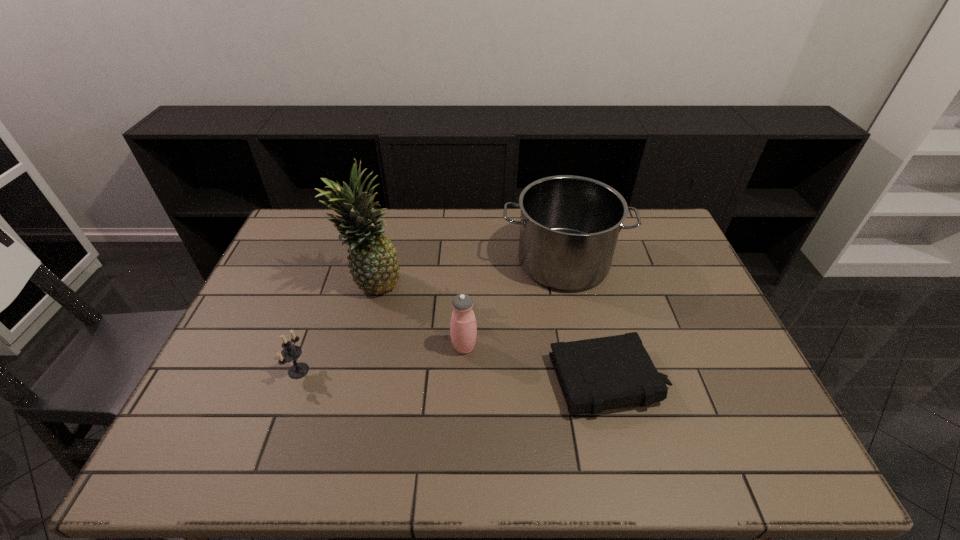
The width and height of the screenshot is (960, 540). Identify the location of vacant position located on the back of the third object from left to right. pyautogui.click(x=468, y=260).

Find the location of a particular element. free spot located on the back of the candle holder is located at coordinates (334, 271).

This screenshot has height=540, width=960. I want to click on vacant space situated 0.320m on the left of the shortest object, so click(x=426, y=380).

The image size is (960, 540). I want to click on object that is at the far edge, so click(x=569, y=225).

In the image, there is a desktop. Where is `free space at the far edge`? This screenshot has width=960, height=540. free space at the far edge is located at coordinates (506, 238).

Locate an element on the screen. This screenshot has width=960, height=540. vacant space at the near edge of the desktop is located at coordinates (648, 435).

I want to click on free location at the left edge of the desktop, so click(295, 255).

At what (x,y) coordinates should I click in order to perform the action: click on vacant space at the right edge of the desktop. Please return your answer as a coordinate pair (x, y). Looking at the image, I should click on (765, 427).

Find the location of a particular element. vacant space at the far left corner of the desktop is located at coordinates (322, 245).

This screenshot has height=540, width=960. I want to click on vacant area at the far right corner of the desktop, so click(661, 238).